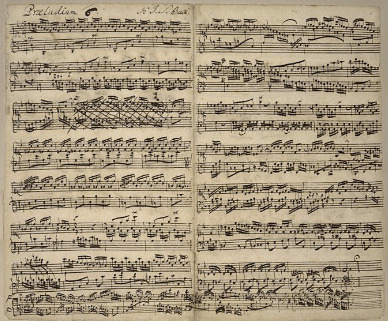
The image size is (388, 321). What are the coordinates of `song book` in the screenshot? It's located at (232, 255).